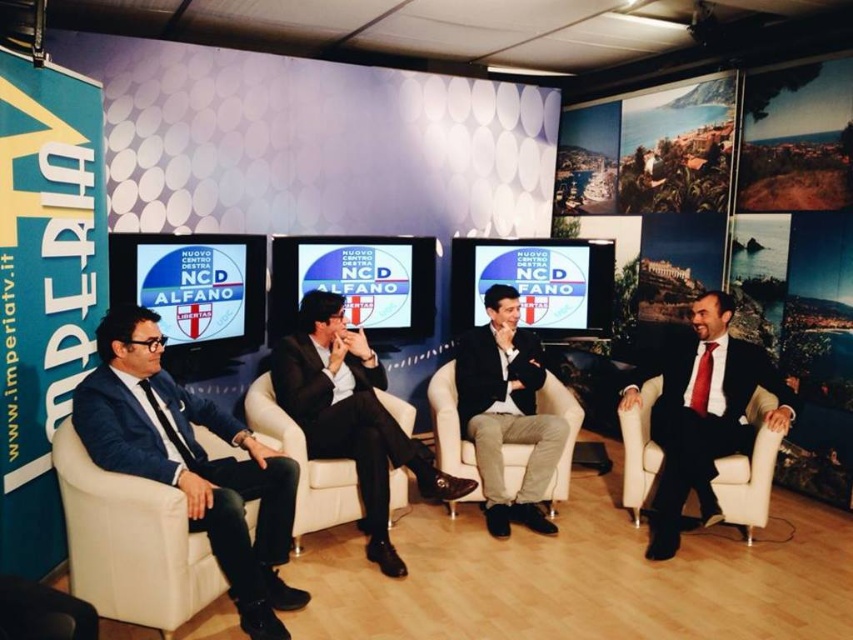
Between point (509, 356) and point (347, 426), which one is positioned in front?

Point (347, 426) is in front.

Does matte black suit at center appear on the right side of dark blue fabric suit at center?

Indeed, matte black suit at center is positioned on the right side of dark blue fabric suit at center.

Locate an element on the screen. matte black suit at center is located at coordinates (506, 412).

Can you confirm if matte black suit at right is taller than dark blue fabric suit at center?

Indeed, matte black suit at right has a greater height compared to dark blue fabric suit at center.

Who is lower down, matte black suit at right or dark blue fabric suit at center?

matte black suit at right is below.

Who is more distant from viewer, (666, 365) or (321, 408)?

The point (666, 365) is more distant.

The width and height of the screenshot is (853, 640). I want to click on matte black suit at right, so click(706, 416).

Is point (743, 428) positioned in front of point (477, 436)?

Yes, it is in front of point (477, 436).

Who is higher up, matte black suit at right or matte black suit at center?

matte black suit at center is higher up.

Does point (701, 392) come closer to viewer compared to point (520, 346)?

Yes.

Locate an element on the screen. This screenshot has height=640, width=853. matte black suit at right is located at coordinates (706, 416).